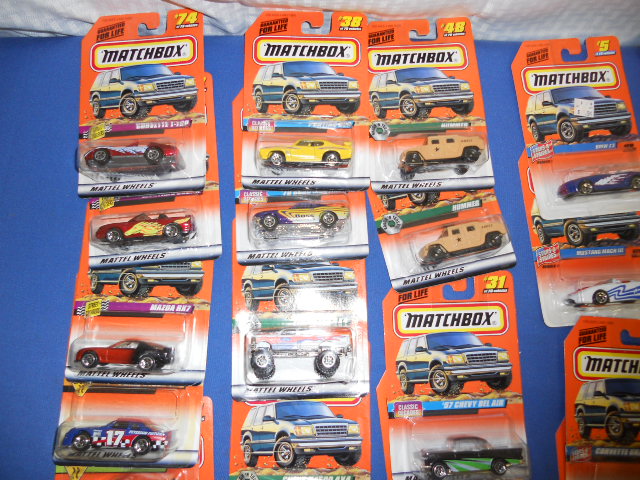
The height and width of the screenshot is (480, 640). What are the coordinates of `blue table` in the screenshot? It's located at (35, 169).